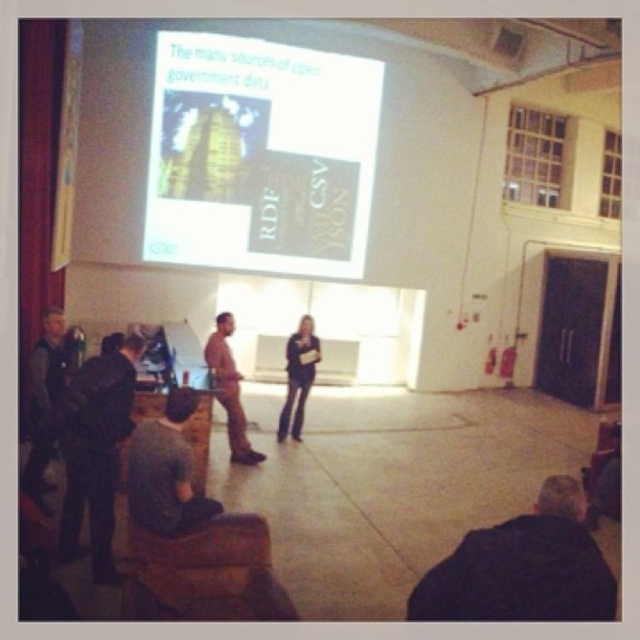
Question: Which of the following is the closest to the observer?

Choices:
 (A) gray fabric shirt at lower left
 (B) dark blue jacket at lower right
 (C) brown leather jacket at center
 (D) matte black pants at center

Answer: (B)

Question: Can you confirm if white matte projector screen at upper center is positioned below dark gray pants at lower left?

Choices:
 (A) no
 (B) yes

Answer: (A)

Question: Is white matte projector screen at upper center thinner than dark blue jacket at lower right?

Choices:
 (A) no
 (B) yes

Answer: (A)

Question: Based on their relative distances, which object is nearer to the white matte projector screen at upper center?

Choices:
 (A) brown leather jacket at center
 (B) gray fabric shirt at lower left
 (C) dark gray pants at lower left

Answer: (A)

Question: Which of these objects is positioned farthest from the dark gray jacket at left?

Choices:
 (A) dark gray pants at lower left
 (B) dark blue jacket at lower right
 (C) white matte projector screen at upper center
 (D) brown leather jacket at center

Answer: (C)

Question: Can you confirm if dark gray pants at lower left is positioned above brown leather jacket at center?

Choices:
 (A) yes
 (B) no

Answer: (B)